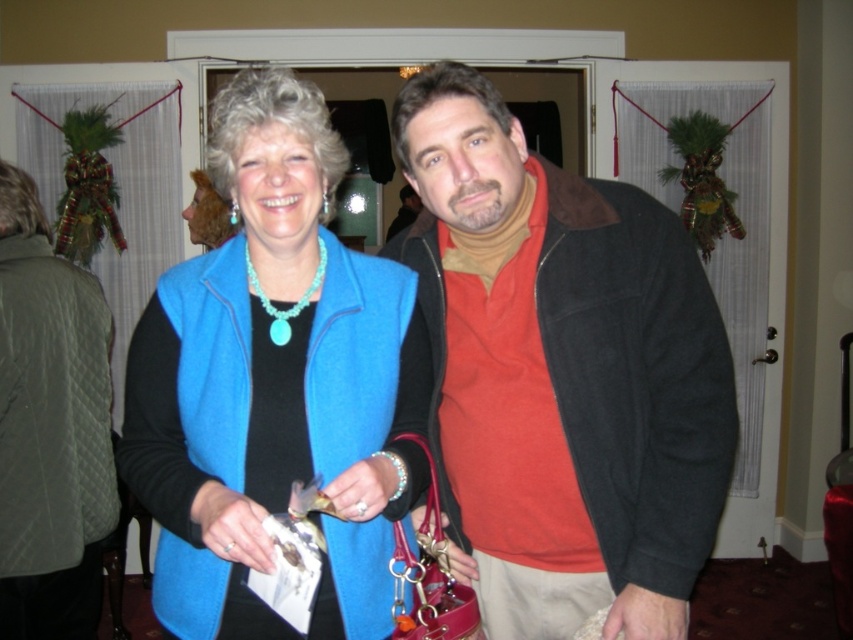
Question: Can you confirm if matte black jacket at center is thinner than matte blue vest at center?

Choices:
 (A) no
 (B) yes

Answer: (A)

Question: Is the position of matte blue vest at center less distant than that of green quilted jacket at left?

Choices:
 (A) no
 (B) yes

Answer: (B)

Question: Which object is closer to the camera taking this photo?

Choices:
 (A) matte black jacket at center
 (B) matte blue vest at center
 (C) green quilted jacket at left

Answer: (B)

Question: Considering the real-world distances, which object is farthest from the matte black jacket at center?

Choices:
 (A) matte blue vest at center
 (B) green quilted jacket at left

Answer: (B)

Question: Can you confirm if matte black jacket at center is wider than matte blue vest at center?

Choices:
 (A) no
 (B) yes

Answer: (B)

Question: Which object is positioned farthest from the matte black jacket at center?

Choices:
 (A) matte blue vest at center
 (B) green quilted jacket at left

Answer: (B)